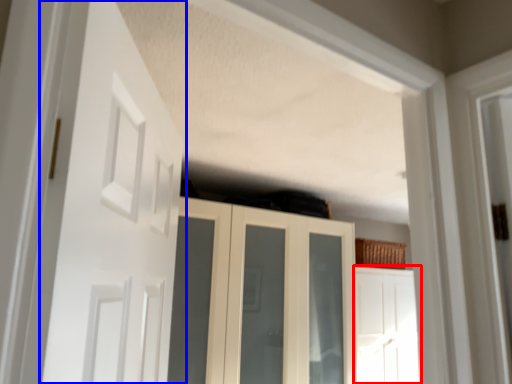
Question: Among these objects, which one is nearest to the camera, door (highlighted by a red box) or door (highlighted by a blue box)?

Choices:
 (A) door
 (B) door

Answer: (B)